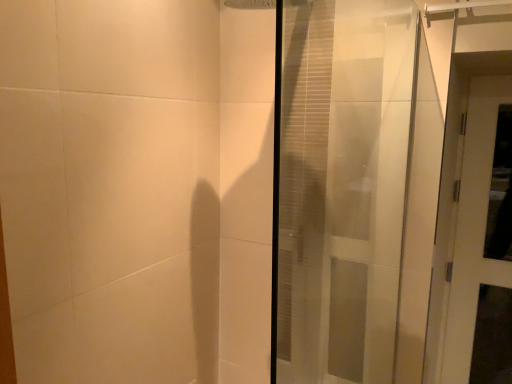
Question: Based on their positions, is white glossy door at right, the 2th door in the left-to-right sequence, located to the left or right of transparent glass door at center, the first door positioned from the front?

Choices:
 (A) right
 (B) left

Answer: (A)

Question: Looking at the image, does white glossy door at right, the 1th door in the back-to-front sequence, seem bigger or smaller compared to transparent glass door at center, the second door when ordered from back to front?

Choices:
 (A) big
 (B) small

Answer: (B)

Question: From a real-world perspective, is white glossy door at right, which ranks as the first door in right-to-left order, positioned above or below transparent glass door at center, the second door in the right-to-left sequence?

Choices:
 (A) below
 (B) above

Answer: (A)

Question: In terms of height, does transparent glass door at center, the second door in the right-to-left sequence, look taller or shorter compared to white glossy door at right, which ranks as the first door in right-to-left order?

Choices:
 (A) short
 (B) tall

Answer: (A)

Question: In terms of width, does transparent glass door at center, the second door when ordered from back to front, look wider or thinner when compared to white glossy door at right, which appears as the second door when viewed from the front?

Choices:
 (A) thin
 (B) wide

Answer: (B)

Question: From a real-world perspective, relative to white glossy door at right, which ranks as the first door in right-to-left order, is transparent glass door at center, the first door positioned from the front, vertically above or below?

Choices:
 (A) below
 (B) above

Answer: (B)

Question: In the image, is transparent glass door at center, the second door in the right-to-left sequence, on the left side or the right side of white glossy door at right, which appears as the second door when viewed from the front?

Choices:
 (A) left
 (B) right

Answer: (A)